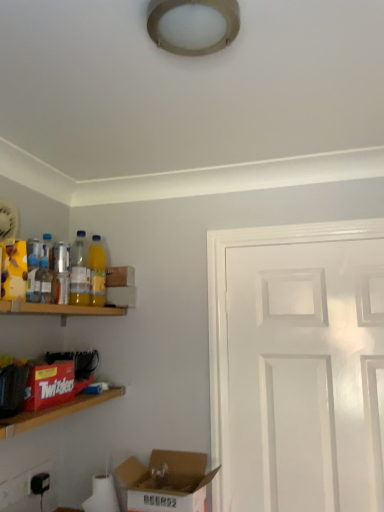
Question: Is wooden shelf at left, placed as the first shelf when sorted from top to bottom, taller or shorter than wooden twizzlers box at left, which is the 1th shelf in bottom-to-top order?

Choices:
 (A) tall
 (B) short

Answer: (A)

Question: From a real-world perspective, is wooden shelf at left, placed as the first shelf when sorted from top to bottom, physically located above or below wooden twizzlers box at left, the 2th shelf viewed from the top?

Choices:
 (A) below
 (B) above

Answer: (B)

Question: Which of these objects is positioned closest to the black plastic electric outlet at lower left, the 1th electric outlet when ordered from right to left?

Choices:
 (A) wooden twizzlers box at left, which is the 1th shelf in bottom-to-top order
 (B) translucent plastic bottle at left, placed as the 2th bottle when sorted from back to front
 (C) white glossy door at right
 (D) cardboard box at lower left, the 1th box from the bottom
 (E) translucent plastic bottle at left, which ranks as the 3th bottle in back-to-front order

Answer: (A)

Question: Estimate the real-world distances between objects in this image. Which object is farther from the white glossy door at right?

Choices:
 (A) wooden shelf at left, the second shelf in the bottom-to-top sequence
 (B) cardboard box at lower left, the first box positioned from the right
 (C) yellow translucent bottle at left, which appears as the first bottle when viewed from the back
 (D) white plastic electric outlet at lower left, arranged as the 1th electric outlet when viewed from the front
 (E) translucent plastic bottle at left, which ranks as the 3th bottle in back-to-front order

Answer: (D)